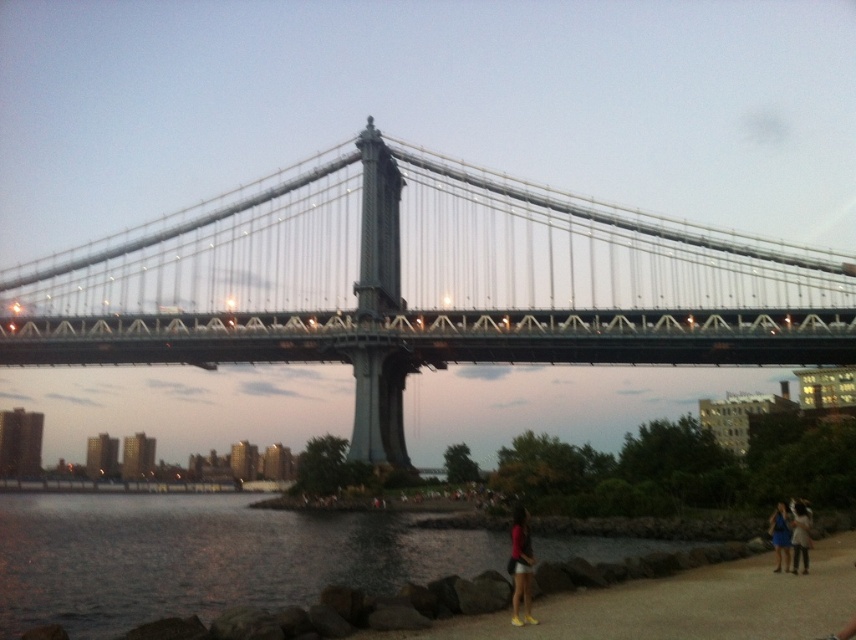
You are a photographer standing on the black metal bridge at upper center and want to take a photo of the blue fabric dress at lower right. Which direction should you move to get the dress into the frame?

The black metal bridge at upper center is positioned over the blue fabric dress at lower right, so you should move downward or to the right to get the dress into the frame.

From the picture: You are standing on the suspension bridge and looking towards the edge where the people are. You notice two points marked on the bridge. The first point is at coordinate point[550,548] and the second is at point[797,500]. Which point is closer to you?

Point[550,548] is further to the camera than point[797,500]. Therefore, point[797,500] is closer to you.

You are a photographer standing on the suspension bridge during dusk. You want to take a photo that includes both the dark water at lower left and the matte pink dress at lower right. Based on their positions, which object should you adjust your camera to focus on first to ensure both are in the frame?

Since the dark water at lower left is to the left of the matte pink dress at lower right, you should focus on the matte pink dress at lower right first as it is closer to the right edge of the frame, ensuring both objects remain within the camera frame when adjusting.